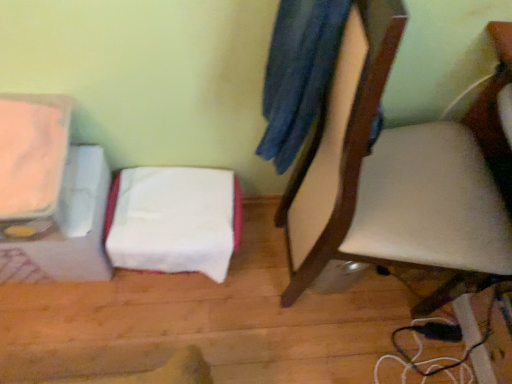
Question: Should I look upward or downward to see white leather chair at center?

Choices:
 (A) up
 (B) down

Answer: (A)

Question: Considering the relative sizes of white fabric at lower left and white leather chair at center in the image provided, is white fabric at lower left shorter than white leather chair at center?

Choices:
 (A) no
 (B) yes

Answer: (B)

Question: Is white fabric at lower left bigger than white leather chair at center?

Choices:
 (A) no
 (B) yes

Answer: (A)

Question: Is the depth of white fabric at lower left greater than that of white leather chair at center?

Choices:
 (A) no
 (B) yes

Answer: (B)

Question: Can you confirm if white fabric at lower left is thinner than white leather chair at center?

Choices:
 (A) yes
 (B) no

Answer: (A)

Question: Does white fabric at lower left have a smaller size compared to white leather chair at center?

Choices:
 (A) yes
 (B) no

Answer: (A)

Question: Can you confirm if white fabric at lower left is wider than white leather chair at center?

Choices:
 (A) yes
 (B) no

Answer: (B)

Question: Is white leather chair at center next to matte orange toaster at left and touching it?

Choices:
 (A) no
 (B) yes

Answer: (A)

Question: Can we say white leather chair at center lies outside matte orange toaster at left?

Choices:
 (A) yes
 (B) no

Answer: (A)

Question: Can you confirm if white leather chair at center is bigger than matte orange toaster at left?

Choices:
 (A) no
 (B) yes

Answer: (B)

Question: Does white leather chair at center have a smaller size compared to matte orange toaster at left?

Choices:
 (A) no
 (B) yes

Answer: (A)

Question: Is white leather chair at center facing towards matte orange toaster at left?

Choices:
 (A) yes
 (B) no

Answer: (B)

Question: Is white leather chair at center behind matte orange toaster at left?

Choices:
 (A) yes
 (B) no

Answer: (B)

Question: Can you confirm if white fabric at lower left is wider than matte orange toaster at left?

Choices:
 (A) no
 (B) yes

Answer: (A)